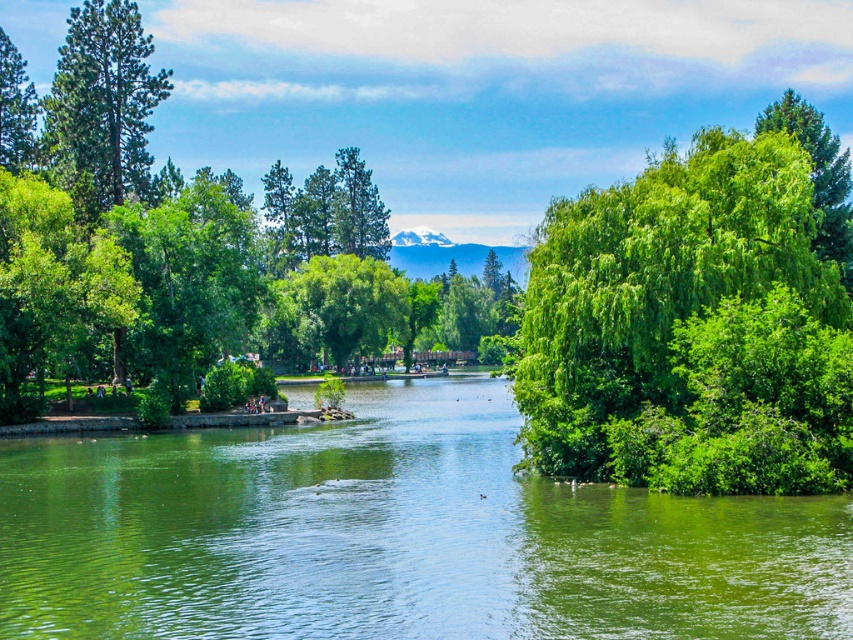
Question: Does green leafy tree at right come behind green textured tree at upper left?

Choices:
 (A) no
 (B) yes

Answer: (A)

Question: Considering the real-world distances, which object is farthest from the green leafy tree at right?

Choices:
 (A) green leafy tree at center
 (B) green smooth water at center
 (C) green leafy tree at upper right

Answer: (A)

Question: Is green leafy tree at right closer to camera compared to green textured tree at upper left?

Choices:
 (A) no
 (B) yes

Answer: (B)

Question: Can you confirm if green smooth water at center is bigger than green textured tree at upper left?

Choices:
 (A) no
 (B) yes

Answer: (A)

Question: Estimate the real-world distances between objects in this image. Which object is farther from the green textured tree at upper left?

Choices:
 (A) green smooth water at center
 (B) green leafy tree at center
 (C) green leafy tree at upper right

Answer: (B)

Question: Which of the following is the farthest from the observer?

Choices:
 (A) green leafy tree at right
 (B) green leafy tree at upper right

Answer: (B)